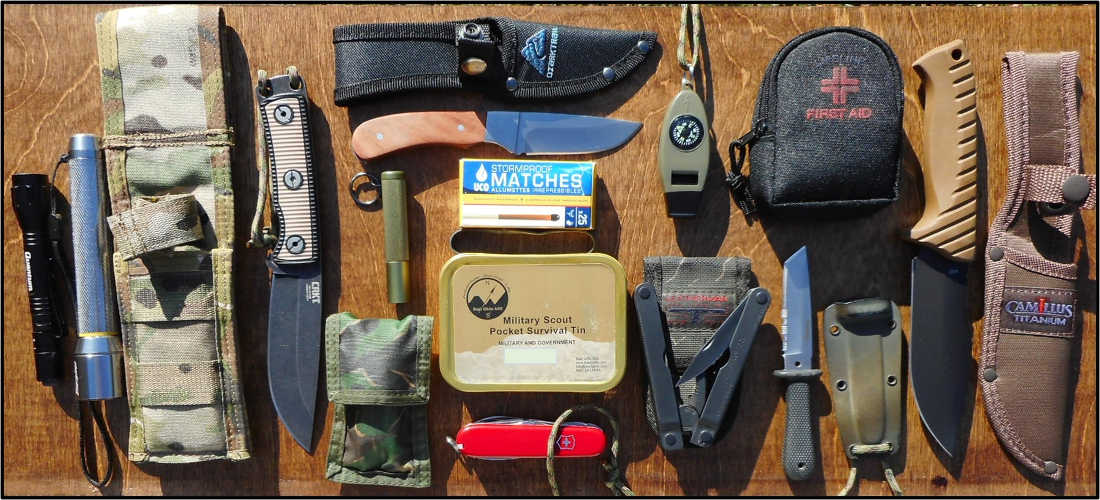
Find the location of `the first aid kit`. the first aid kit is located at coordinates (813, 174).